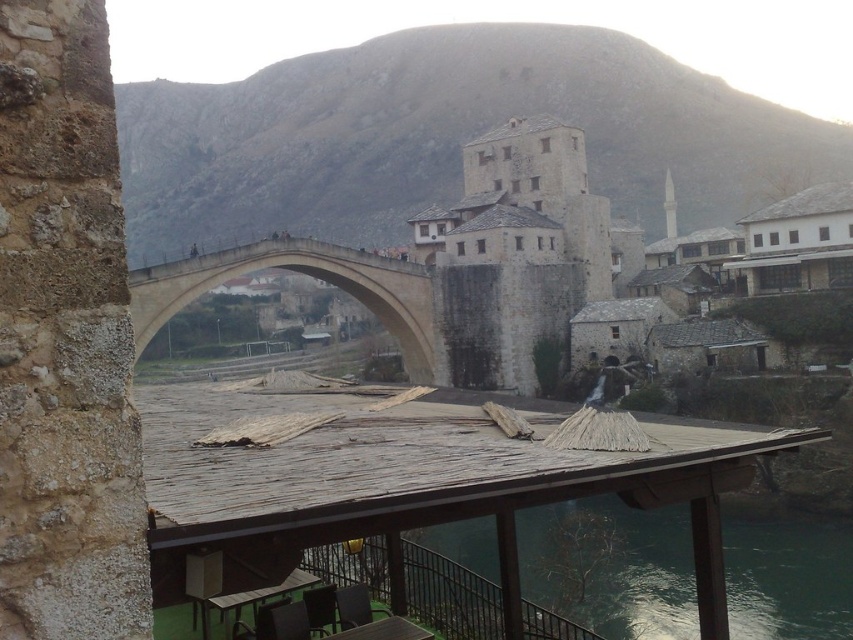
You are standing at the historic stone bridge and looking towards the minaret. There are two points marked on the bridge deck. One is at coordinates point (x=804, y=621) and the other is at point (x=670, y=179). Which point is closer to you as you face the minaret?

Point (x=804, y=621) is in front of point (x=670, y=179), so it is closer to you as you face the minaret.

You are a tourist standing at the base of the beige stone bridge at center, wanting to take a photo of it. If you move 10 meters away from the bridge, how far will you be from the camera?

The beige stone bridge at center and camera are 20.15 meters apart. If you move 10 meters away from the bridge, you will be 10.15 meters away from the camera.

You are an architect visiting the historic site and need to determine which structure occupies more space in the foreground. Based on the beige stone bridge at center and the white stone tower at center, which one is bigger?

The beige stone bridge at center has a larger size compared to the white stone tower at center, so the beige stone bridge at center occupies more space in the foreground.